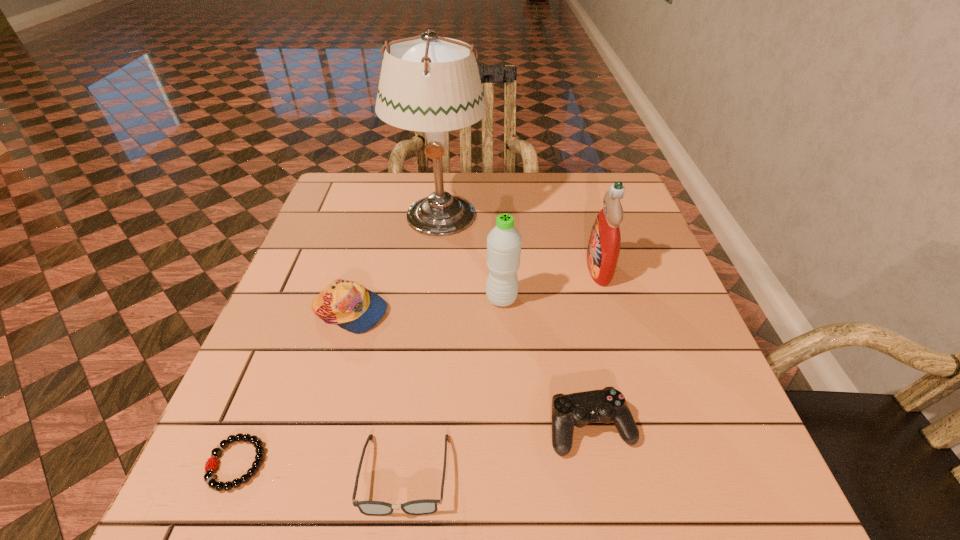
You are a GUI agent. You are given a task and a screenshot of the screen. Output one action in this format:
    pyautogui.click(x=<x>, y=<y>)
    Task: Click on the empty space between the shortest object and the sixth tallest object
    The image size is (960, 540).
    Given the screenshot: What is the action you would take?
    pyautogui.click(x=321, y=469)

You are a GUI agent. You are given a task and a screenshot of the screen. Output one action in this format:
    pyautogui.click(x=<x>, y=<y>)
    Task: Click on the vacant space in between the detergent and the cap
    The height and width of the screenshot is (540, 960).
    Given the screenshot: What is the action you would take?
    pyautogui.click(x=474, y=291)

Image resolution: width=960 pixels, height=540 pixels. In order to click on empty space between the second shortest object and the cap in this screenshot , I will do `click(377, 393)`.

Where is `vacant region between the control and the water bottle`? vacant region between the control and the water bottle is located at coordinates (546, 363).

At what (x,y) coordinates should I click in order to perform the action: click on vacant space that's between the bracelet and the control. Please return your answer as a coordinate pair (x, y). Image resolution: width=960 pixels, height=540 pixels. Looking at the image, I should click on (414, 446).

In order to click on blank region between the shortest object and the detergent in this screenshot , I will do `click(418, 366)`.

Locate an element on the screen. free spot between the farthest object and the control is located at coordinates (516, 322).

The width and height of the screenshot is (960, 540). In order to click on vacant area that lies between the shortest object and the control in this screenshot , I will do `click(414, 446)`.

At what (x,y) coordinates should I click in order to perform the action: click on the second closest object to the detergent. Please return your answer as a coordinate pair (x, y). The image size is (960, 540). Looking at the image, I should click on (431, 84).

You are a GUI agent. You are given a task and a screenshot of the screen. Output one action in this format:
    pyautogui.click(x=<x>, y=<y>)
    Task: Click on the object that is the fifth closest to the cap
    
    Given the screenshot: What is the action you would take?
    pyautogui.click(x=607, y=405)